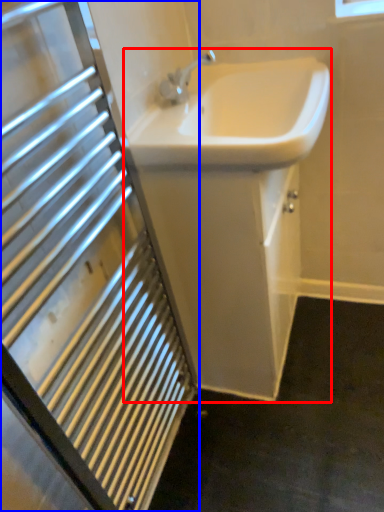
Question: Which of the following is the closest to the observer, sink (highlighted by a red box) or bathroom cabinet (highlighted by a blue box)?

Choices:
 (A) sink
 (B) bathroom cabinet

Answer: (B)